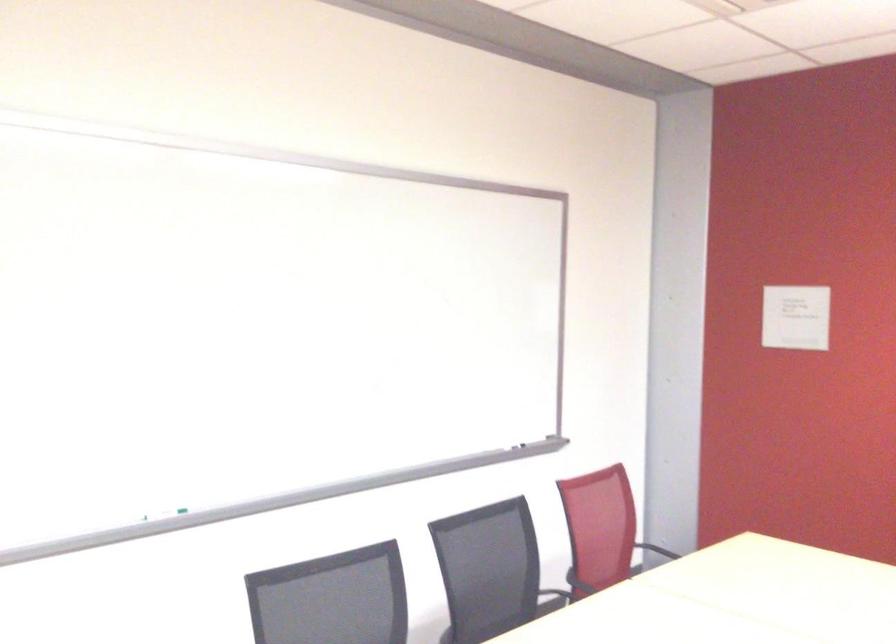
Where is `black chair armrest`? black chair armrest is located at coordinates (552, 599).